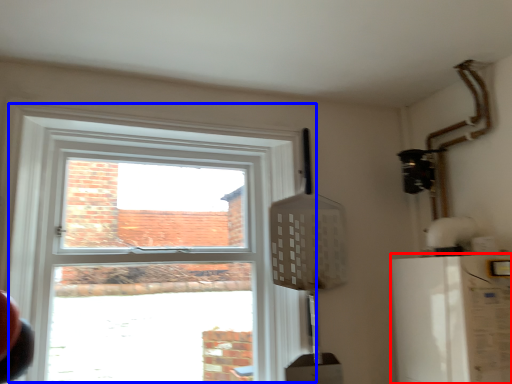
Question: Which object is closer to the camera taking this photo, appliance (highlighted by a red box) or window (highlighted by a blue box)?

Choices:
 (A) appliance
 (B) window

Answer: (A)